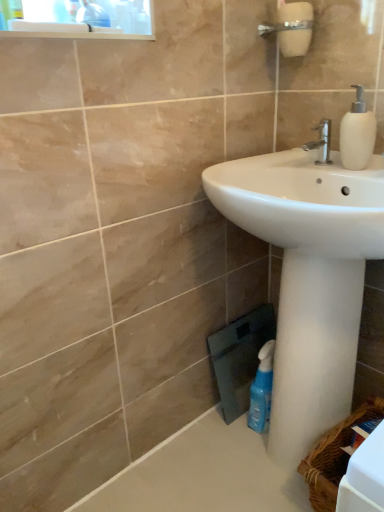
Question: From the image's perspective, does woven brown basket at lower right appear lower than white matte soap dispenser at upper right?

Choices:
 (A) no
 (B) yes

Answer: (B)

Question: Could you tell me if woven brown basket at lower right is facing white matte soap dispenser at upper right?

Choices:
 (A) no
 (B) yes

Answer: (A)

Question: From the image's perspective, is woven brown basket at lower right above white matte soap dispenser at upper right?

Choices:
 (A) yes
 (B) no

Answer: (B)

Question: Is there a large distance between woven brown basket at lower right and white matte soap dispenser at upper right?

Choices:
 (A) no
 (B) yes

Answer: (A)

Question: Is the depth of woven brown basket at lower right less than that of white matte soap dispenser at upper right?

Choices:
 (A) yes
 (B) no

Answer: (A)

Question: From the image's perspective, is blue translucent bottle at lower right above or below silver metallic faucet at upper center?

Choices:
 (A) above
 (B) below

Answer: (B)

Question: Considering the positions of blue translucent bottle at lower right and silver metallic faucet at upper center in the image, is blue translucent bottle at lower right taller or shorter than silver metallic faucet at upper center?

Choices:
 (A) tall
 (B) short

Answer: (A)

Question: Relative to silver metallic faucet at upper center, is blue translucent bottle at lower right in front or behind?

Choices:
 (A) front
 (B) behind

Answer: (B)

Question: In the image, is blue translucent bottle at lower right on the left side or the right side of silver metallic faucet at upper center?

Choices:
 (A) right
 (B) left

Answer: (B)

Question: From a real-world perspective, is blue translucent bottle at lower right physically located above or below woven brown basket at lower right?

Choices:
 (A) above
 (B) below

Answer: (A)

Question: From the image's perspective, is blue translucent bottle at lower right above or below woven brown basket at lower right?

Choices:
 (A) below
 (B) above

Answer: (B)

Question: Is point tap(256, 414) closer or farther from the camera than point tap(337, 490)?

Choices:
 (A) farther
 (B) closer

Answer: (A)

Question: Is blue translucent bottle at lower right taller or shorter than woven brown basket at lower right?

Choices:
 (A) tall
 (B) short

Answer: (A)

Question: Is white matte soap dispenser at upper right situated inside blue translucent bottle at lower right or outside?

Choices:
 (A) inside
 (B) outside

Answer: (B)

Question: Does point (354, 140) appear closer or farther from the camera than point (261, 400)?

Choices:
 (A) farther
 (B) closer

Answer: (B)